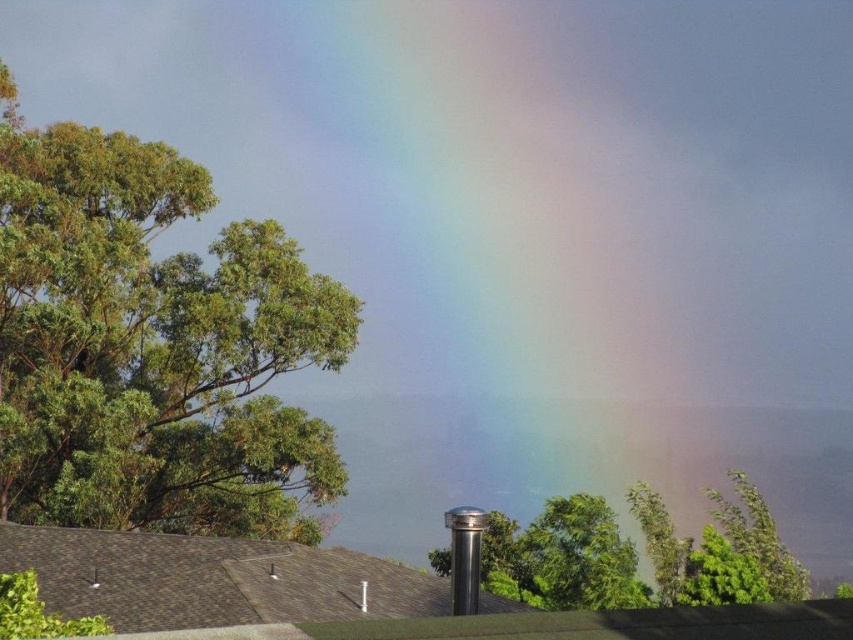
You are standing in front of the roof and want to place a small decoration on both the point at (86, 145) and the point at (610, 560). Which point is closer to you so that you can reach it easily?

The point at (86, 145) is closer to you than the point at (610, 560), so you can reach it easily.